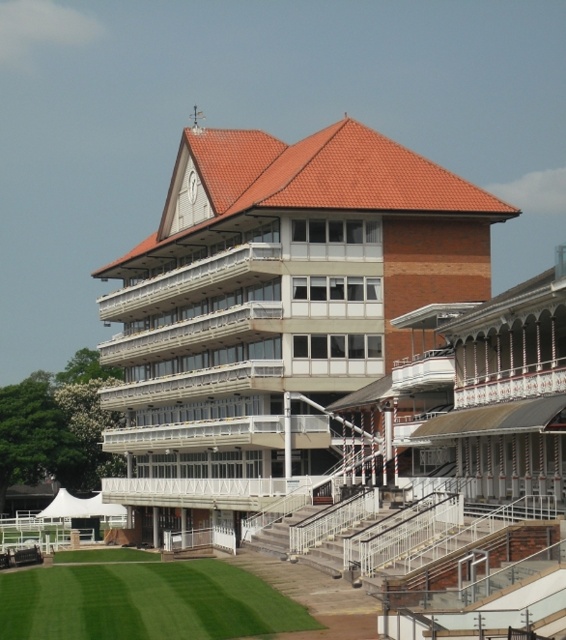
Looking at this image, you are standing at the green grass at lower left and want to reach the brown brick building at center. Which direction should you walk to get there?

You should walk to the right to reach the brown brick building at center from the green grass at lower left since the brown brick building at center is to the right of green grass at lower left.

You are a drone operator trying to capture aerial footage of the brown brick building at center and the green grass at lower left. From your current position above the building, which direction should you tilt your camera to frame both objects in the same shot?

Since the brown brick building at center is positioned over green grass at lower left, you should tilt the camera downward to include both the brown brick building at center and the green grass at lower left in the shot.